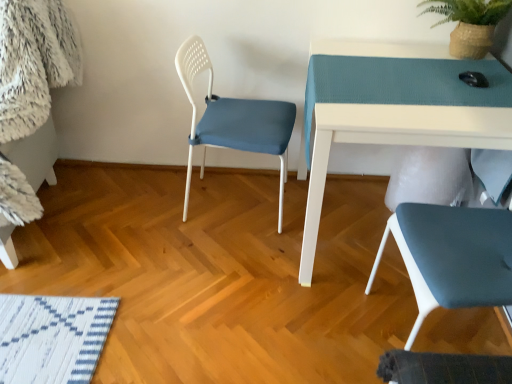
Where is `free space to the left of matte blue chair at lower right, which appears as the second chair when viewed from the left`? This screenshot has width=512, height=384. free space to the left of matte blue chair at lower right, which appears as the second chair when viewed from the left is located at coordinates (316, 329).